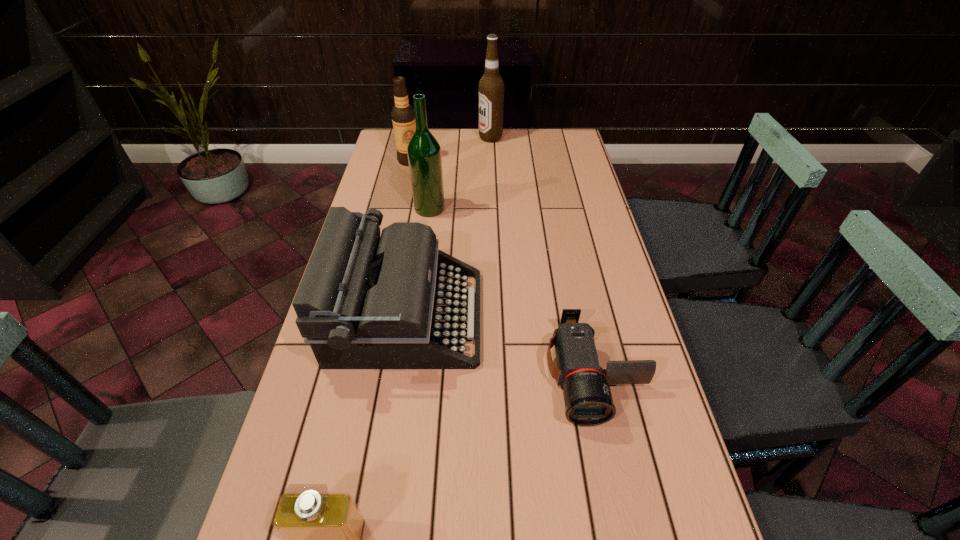
Find the location of a particular element. The width and height of the screenshot is (960, 540). vacant space at the far edge of the desktop is located at coordinates (504, 138).

The width and height of the screenshot is (960, 540). I want to click on vacant point at the left edge, so click(375, 187).

Locate an element on the screen. This screenshot has width=960, height=540. blank space at the right edge is located at coordinates (571, 264).

Where is `free area in between the typewriter and the rightmost object`? The image size is (960, 540). free area in between the typewriter and the rightmost object is located at coordinates (500, 345).

Locate an element on the screen. The image size is (960, 540). vacant region between the farthest alcohol and the camcorder is located at coordinates (542, 256).

This screenshot has height=540, width=960. Find the location of `vacant space that's between the leftmost alcohol and the rightmost object`. vacant space that's between the leftmost alcohol and the rightmost object is located at coordinates (502, 267).

I want to click on object identified as the fourth closest to the rightmost alcohol, so click(x=588, y=401).

Where is `object identified as the fourth closest to the nearest object`? This screenshot has height=540, width=960. object identified as the fourth closest to the nearest object is located at coordinates (403, 116).

Select which alcohol is the second closest to the rightmost object. Please provide its 2D coordinates. Your answer should be formatted as a tuple, i.e. [(x, y)], where the tuple contains the x and y coordinates of a point satisfying the conditions above.

[(403, 116)]

Select which alcohol appears as the closest to the typewriter. Please provide its 2D coordinates. Your answer should be formatted as a tuple, i.e. [(x, y)], where the tuple contains the x and y coordinates of a point satisfying the conditions above.

[(424, 152)]